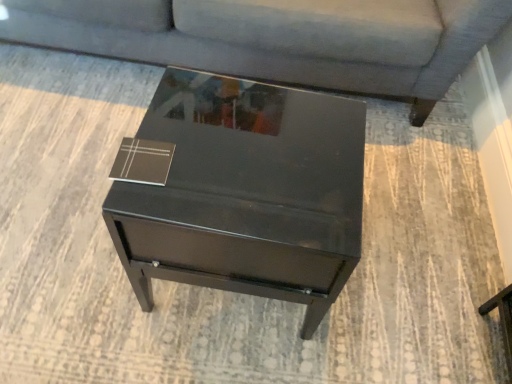
Image resolution: width=512 pixels, height=384 pixels. In order to click on free space in front of brown leather book at upper left in this screenshot , I will do `click(142, 200)`.